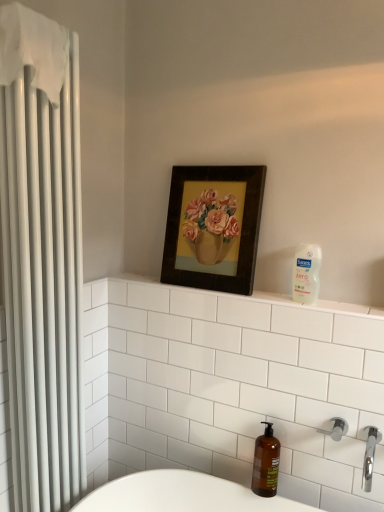
This screenshot has width=384, height=512. Identify the location of white fabric shower curtain at left. (42, 257).

Measure the distance between point [344,425] and camera.

1.38 meters.

The height and width of the screenshot is (512, 384). Find the location of `white plastic bottle at upper right`. white plastic bottle at upper right is located at coordinates (306, 273).

Does wooden framed painting of flowers at upper center turn towards white plastic bottle at upper right?

No, wooden framed painting of flowers at upper center does not turn towards white plastic bottle at upper right.

Considering the positions of objects wooden framed painting of flowers at upper center and white plastic bottle at upper right in the image provided, who is in front, wooden framed painting of flowers at upper center or white plastic bottle at upper right?

white plastic bottle at upper right is closer to the camera.

Considering the sizes of wooden framed painting of flowers at upper center and white plastic bottle at upper right in the image, is wooden framed painting of flowers at upper center bigger or smaller than white plastic bottle at upper right?

Clearly, wooden framed painting of flowers at upper center is larger in size than white plastic bottle at upper right.

From a real-world perspective, which object stands above the other?

wooden framed painting of flowers at upper center is physically above.

Looking at this image, what's the angular difference between satin nickel shower at lower right and wooden framed painting of flowers at upper center's facing directions?

0.321 degrees separate the facing orientations of satin nickel shower at lower right and wooden framed painting of flowers at upper center.

From a real-world perspective, between satin nickel shower at lower right and wooden framed painting of flowers at upper center, who is vertically higher?

From a 3D spatial view, wooden framed painting of flowers at upper center is above.

Is point (332, 419) closer or farther from the camera than point (230, 283)?

Clearly, point (332, 419) is closer to the camera than point (230, 283).

Does satin nickel shower at lower right appear on the left side of wooden framed painting of flowers at upper center?

No.

Is clear plastic soap dispenser at upper right oriented away from white fabric shower curtain at left?

No, white fabric shower curtain at left is not at the back of clear plastic soap dispenser at upper right.

Is clear plastic soap dispenser at upper right positioned behind white fabric shower curtain at left?

Yes, the depth of clear plastic soap dispenser at upper right is greater than that of white fabric shower curtain at left.

Are clear plastic soap dispenser at upper right and white fabric shower curtain at left beside each other?

No, clear plastic soap dispenser at upper right is not making contact with white fabric shower curtain at left.

Find the location of a particular element. The height and width of the screenshot is (512, 384). balustrade behind the white fabric shower curtain at left is located at coordinates (347, 308).

Between white plastic bottle at upper right and wooden framed painting of flowers at upper center, which one is positioned behind?

wooden framed painting of flowers at upper center is behind.

Is white plastic bottle at upper right oriented away from wooden framed painting of flowers at upper center?

No, wooden framed painting of flowers at upper center is not at the back of white plastic bottle at upper right.

Is white plastic bottle at upper right bigger than wooden framed painting of flowers at upper center?

No, white plastic bottle at upper right is not bigger than wooden framed painting of flowers at upper center.

Is white plastic bottle at upper right outside of wooden framed painting of flowers at upper center?

Yes, white plastic bottle at upper right is not within wooden framed painting of flowers at upper center.

Could you tell me if white fabric shower curtain at left is facing amber glass soap dispenser at lower right?

No, white fabric shower curtain at left is not aimed at amber glass soap dispenser at lower right.

Between white fabric shower curtain at left and amber glass soap dispenser at lower right, which one has larger size?

With larger size is white fabric shower curtain at left.

Is the depth of white fabric shower curtain at left less than that of amber glass soap dispenser at lower right?

Yes, it is.

Is amber glass soap dispenser at lower right inside white fabric shower curtain at left?

That's incorrect, amber glass soap dispenser at lower right is not inside white fabric shower curtain at left.

Is point (304, 248) less distant than point (321, 429)?

That is False.

Can you confirm if white plastic bottle at upper right is positioned to the right of satin nickel shower at lower right?

In fact, white plastic bottle at upper right is to the left of satin nickel shower at lower right.

From the image's perspective, would you say white plastic bottle at upper right is shown under satin nickel shower at lower right?

No.

Considering the relative sizes of white plastic bottle at upper right and satin nickel shower at lower right in the image provided, is white plastic bottle at upper right shorter than satin nickel shower at lower right?

No, white plastic bottle at upper right is not shorter than satin nickel shower at lower right.

Is white plastic bottle at upper right aimed at clear plastic soap dispenser at upper right?

No, white plastic bottle at upper right is not turned towards clear plastic soap dispenser at upper right.

Considering the relative positions of white plastic bottle at upper right and clear plastic soap dispenser at upper right in the image provided, is white plastic bottle at upper right to the left of clear plastic soap dispenser at upper right from the viewer's perspective?

No.

From a real-world perspective, is white plastic bottle at upper right physically below clear plastic soap dispenser at upper right?

No.

Considering the positions of objects white plastic bottle at upper right and clear plastic soap dispenser at upper right in the image provided, who is behind, white plastic bottle at upper right or clear plastic soap dispenser at upper right?

white plastic bottle at upper right.

I want to click on cleaning product beneath the wooden framed painting of flowers at upper center (from a real-world perspective), so click(x=306, y=273).

At what (x,y) coordinates should I click in order to perform the action: click on shower to the right of wooden framed painting of flowers at upper center. Please return your answer as a coordinate pair (x, y). The height and width of the screenshot is (512, 384). Looking at the image, I should click on (336, 429).

Looking at the image, which one is located further to amber glass soap dispenser at lower right, white fabric shower curtain at left or chrome metallic faucet at lower right?

Among the two, white fabric shower curtain at left is located further to amber glass soap dispenser at lower right.

Which object lies further to the anchor point clear plastic soap dispenser at upper right, satin nickel shower at lower right or white fabric shower curtain at left?

Among the two, white fabric shower curtain at left is located further to clear plastic soap dispenser at upper right.

Which object lies nearer to the anchor point clear plastic soap dispenser at upper right, satin nickel shower at lower right or amber glass soap dispenser at lower right?

Among the two, satin nickel shower at lower right is located nearer to clear plastic soap dispenser at upper right.

Estimate the real-world distances between objects in this image. Which object is closer to clear plastic soap dispenser at upper right, wooden framed painting of flowers at upper center or satin nickel shower at lower right?

wooden framed painting of flowers at upper center lies closer to clear plastic soap dispenser at upper right than the other object.

Based on their spatial positions, is clear plastic soap dispenser at upper right or chrome metallic faucet at lower right closer to amber glass soap dispenser at lower right?

chrome metallic faucet at lower right is positioned closer to the anchor amber glass soap dispenser at lower right.

Based on their spatial positions, is wooden framed painting of flowers at upper center or chrome metallic faucet at lower right closer to clear plastic soap dispenser at upper right?

The object closer to clear plastic soap dispenser at upper right is wooden framed painting of flowers at upper center.

From the image, which object appears to be farther from chrome metallic faucet at lower right, amber glass soap dispenser at lower right or clear plastic soap dispenser at upper right?

clear plastic soap dispenser at upper right lies further to chrome metallic faucet at lower right than the other object.

Which object lies further to the anchor point chrome metallic faucet at lower right, satin nickel shower at lower right or amber glass soap dispenser at lower right?

Based on the image, amber glass soap dispenser at lower right appears to be further to chrome metallic faucet at lower right.

Identify the location of balustrade between white plastic bottle at upper right and chrome metallic faucet at lower right vertically. The height and width of the screenshot is (512, 384). (347, 308).

Find the location of a particular element. sink between white plastic bottle at upper right and amber glass soap dispenser at lower right vertically is located at coordinates (370, 456).

The image size is (384, 512). In order to click on cleaning product between wooden framed painting of flowers at upper center and amber glass soap dispenser at lower right vertically in this screenshot , I will do click(306, 273).

This screenshot has height=512, width=384. Identify the location of balustrade between white plastic bottle at upper right and amber glass soap dispenser at lower right vertically. (347, 308).